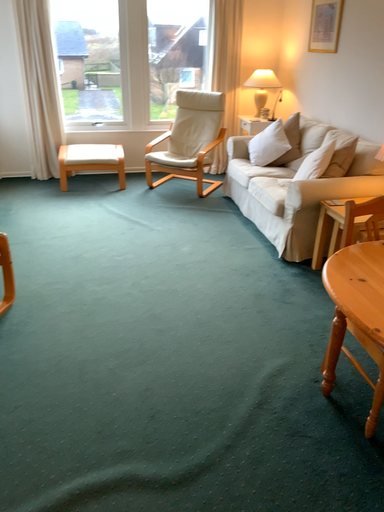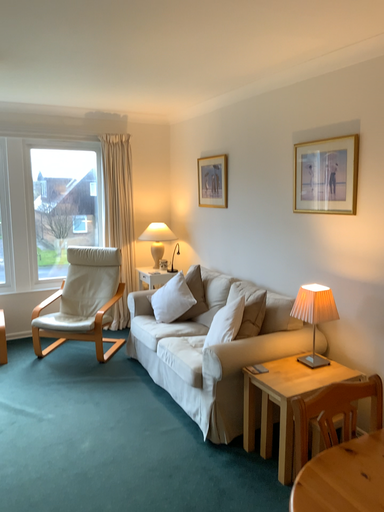
Question: Which way did the camera rotate in the video?

Choices:
 (A) rotated upward
 (B) rotated downward

Answer: (A)